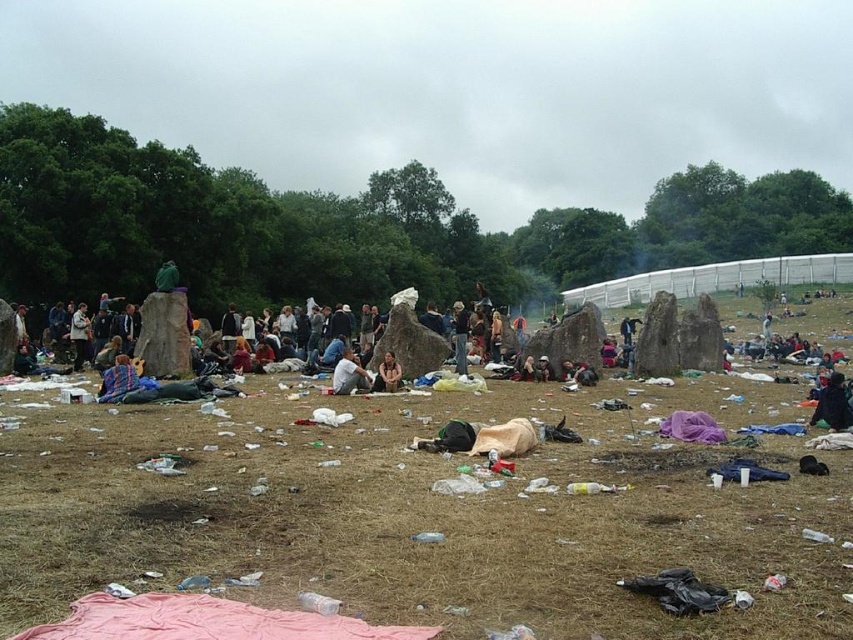
Question: Can you confirm if black fabric bag at center is bigger than blue fabric at center?

Choices:
 (A) no
 (B) yes

Answer: (B)

Question: Estimate the real-world distances between objects in this image. Which object is farther from the black fabric bag at center?

Choices:
 (A) light brown fabric at center
 (B) brown dry grass at center

Answer: (A)

Question: Can you confirm if black fabric bag at center is positioned below smooth brown leather jacket at center?

Choices:
 (A) yes
 (B) no

Answer: (A)

Question: Estimate the real-world distances between objects in this image. Which object is farther from the brown dry grass at center?

Choices:
 (A) black fabric bag at center
 (B) blue fabric at center

Answer: (A)

Question: Which point is closer to the camera?

Choices:
 (A) (819, 404)
 (B) (123, 358)

Answer: (A)

Question: Can you confirm if light brown fabric at center is wider than smooth brown leather jacket at center?

Choices:
 (A) yes
 (B) no

Answer: (A)